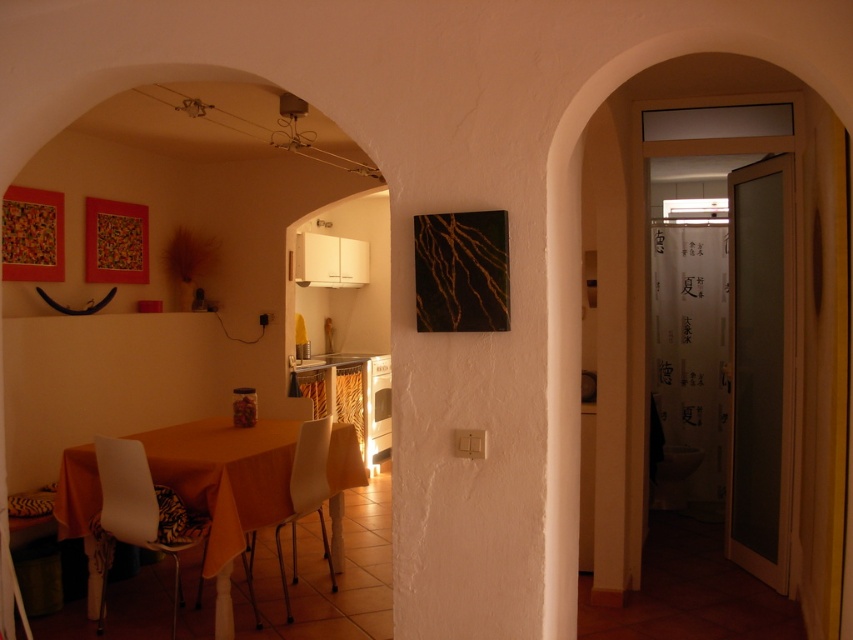
From the picture: Between white plastic chair at lower left and white plastic chair at center, which one is positioned higher?

white plastic chair at lower left

Does point (173, 630) come in front of point (317, 492)?

That is True.

I want to click on white plastic chair at lower left, so click(x=137, y=513).

Who is taller, orange fabric table at center or white plastic chair at center?

Standing taller between the two is white plastic chair at center.

Who is more forward, (62, 525) or (302, 484)?

Point (62, 525) is in front.

I want to click on orange fabric table at center, so click(225, 484).

The image size is (853, 640). I want to click on orange fabric table at center, so click(x=225, y=484).

Can you confirm if orange fabric table at center is positioned below white plastic chair at lower left?

No.

Who is taller, orange fabric table at center or white plastic chair at lower left?

With more height is white plastic chair at lower left.

Who is more forward, (166, 451) or (158, 545)?

Point (158, 545) is more forward.

Where is `orange fabric table at center`? The height and width of the screenshot is (640, 853). orange fabric table at center is located at coordinates (225, 484).